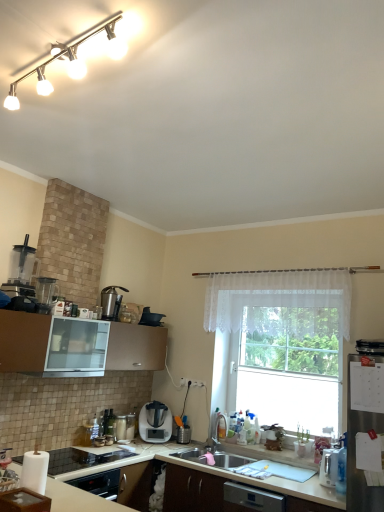
Question: Should I look upward or downward to see satin silver blender at center, marked as the first home appliance in a back-to-front arrangement?

Choices:
 (A) down
 (B) up

Answer: (A)

Question: Is the position of white glossy countertop at lower left, which appears as the 2th countertop when ordered from the bottom, less distant than that of white glossy blender at lower center, which appears as the fifth appliance when viewed from the top?

Choices:
 (A) no
 (B) yes

Answer: (B)

Question: From a real-world perspective, is white glossy countertop at lower left, the first countertop viewed from the top, located higher than white glossy blender at lower center, which appears as the 2th appliance when viewed from the back?

Choices:
 (A) no
 (B) yes

Answer: (A)

Question: Is white glossy countertop at lower left, which appears as the 2th countertop when ordered from the bottom, positioned beyond the bounds of white glossy blender at lower center, placed as the 1th appliance when sorted from bottom to top?

Choices:
 (A) no
 (B) yes

Answer: (B)

Question: Considering the relative positions of white glossy countertop at lower left, which appears as the 2th countertop when ordered from the bottom, and white glossy blender at lower center, marked as the third appliance in a left-to-right arrangement, in the image provided, is white glossy countertop at lower left, which appears as the 2th countertop when ordered from the bottom, behind white glossy blender at lower center, marked as the third appliance in a left-to-right arrangement,?

Choices:
 (A) yes
 (B) no

Answer: (B)

Question: Is white glossy countertop at lower left, the first countertop viewed from the top, facing towards white glossy blender at lower center, which is counted as the 3th appliance, starting from the right?

Choices:
 (A) yes
 (B) no

Answer: (B)

Question: Can you confirm if white glossy countertop at lower left, the first countertop viewed from the top, is thinner than white glossy blender at lower center, placed as the 1th appliance when sorted from bottom to top?

Choices:
 (A) yes
 (B) no

Answer: (B)

Question: Does satin silver blender at center, acting as the 2th home appliance starting from the left, touch white matte countertop at lower center, placed as the second countertop when sorted from top to bottom?

Choices:
 (A) no
 (B) yes

Answer: (A)

Question: Is satin silver blender at center, which ranks as the second home appliance in front-to-back order, shorter than white matte countertop at lower center, placed as the second countertop when sorted from top to bottom?

Choices:
 (A) no
 (B) yes

Answer: (B)

Question: Is satin silver blender at center, marked as the first home appliance in a back-to-front arrangement, located outside white matte countertop at lower center, placed as the second countertop when sorted from top to bottom?

Choices:
 (A) no
 (B) yes

Answer: (B)

Question: Is satin silver blender at center, which ranks as the second home appliance in front-to-back order, smaller than white matte countertop at lower center, the first countertop positioned from the bottom?

Choices:
 (A) no
 (B) yes

Answer: (B)

Question: From the image's perspective, would you say satin silver blender at center, which ranks as the second home appliance in front-to-back order, is positioned over white matte countertop at lower center, the first countertop positioned from the bottom?

Choices:
 (A) yes
 (B) no

Answer: (A)

Question: From the image's perspective, is satin silver blender at center, which ranks as the second home appliance in front-to-back order, under white matte countertop at lower center, placed as the second countertop when sorted from top to bottom?

Choices:
 (A) no
 (B) yes

Answer: (A)

Question: Does metallic silver toaster at lower left, the 4th appliance in the top-to-bottom sequence, come in front of brown matte cabinet at lower left?

Choices:
 (A) no
 (B) yes

Answer: (A)